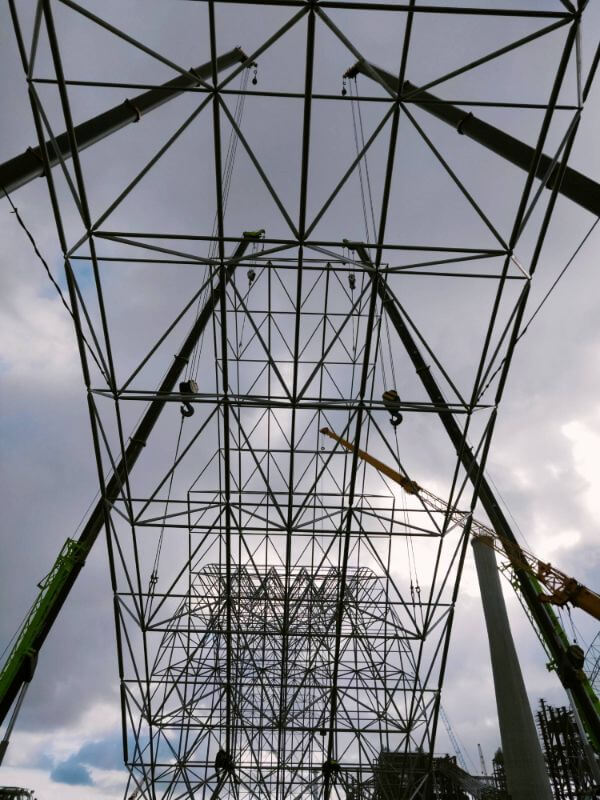
Locate an element on the screen. The image size is (600, 800). hook is located at coordinates (189, 410), (398, 418).